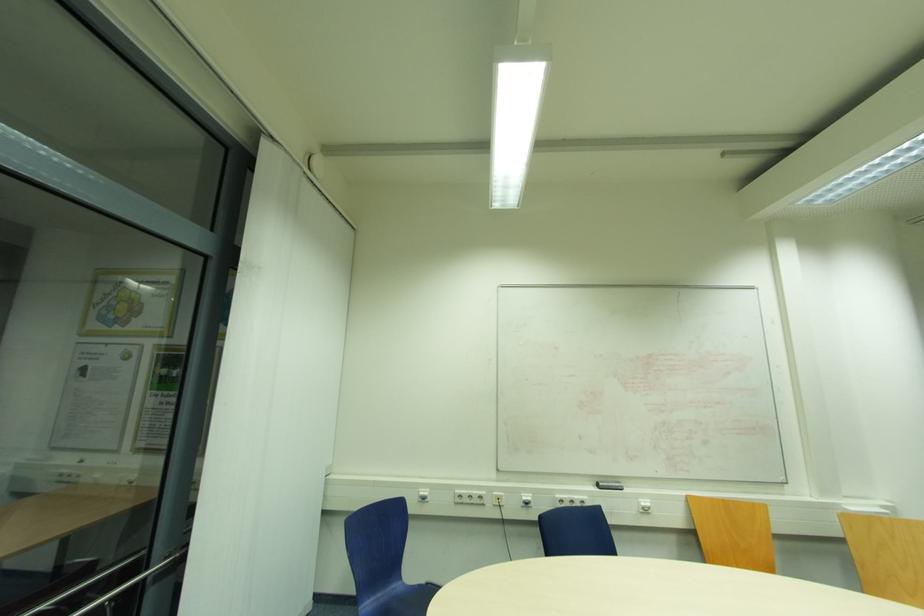
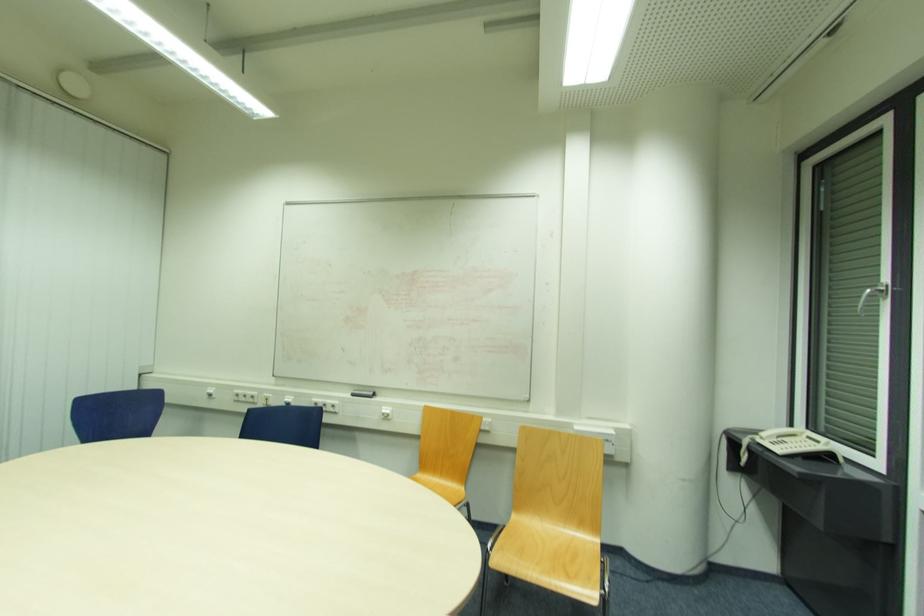
Question: What movement of the cameraman would produce the second image?

Choices:
 (A) Left
 (B) Right
 (C) Forward
 (D) Backward

Answer: (B)